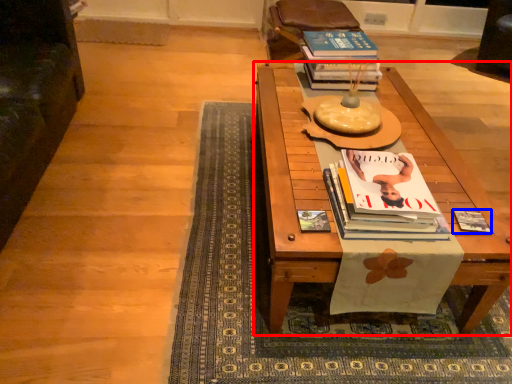
Question: Which of the following is the farthest to the observer, table (highlighted by a red box) or book (highlighted by a blue box)?

Choices:
 (A) table
 (B) book

Answer: (B)